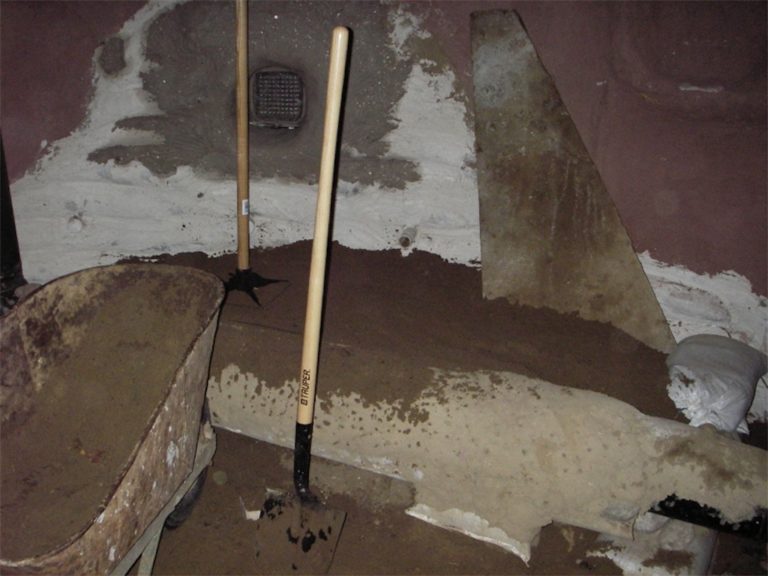
At what (x,y) coordinates should I click in order to perform the action: click on tub. Please return your answer as a coordinate pair (x, y). The height and width of the screenshot is (576, 768). Looking at the image, I should click on (65, 420).